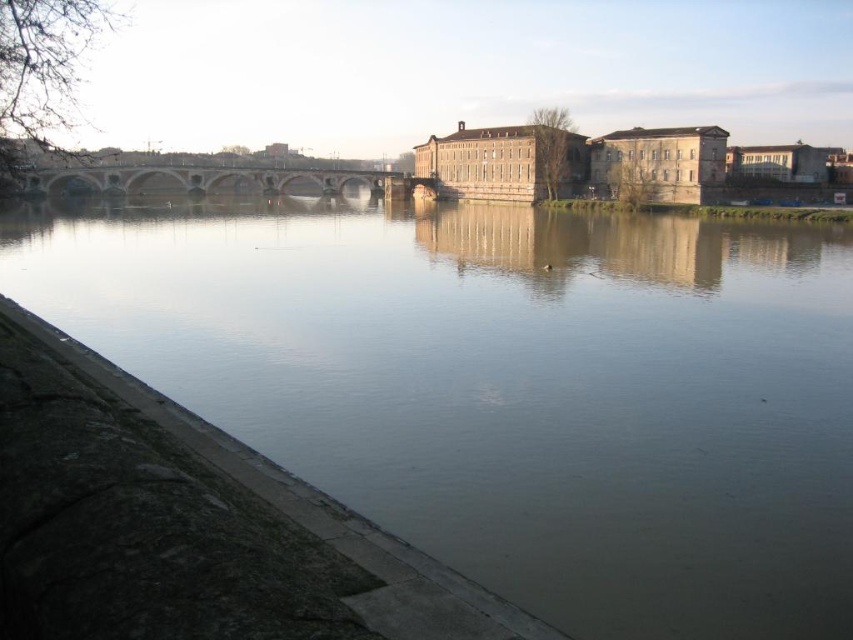
Which of these two, greenish water at lower left or brown stone bridge at center, stands taller?

greenish water at lower left

Who is positioned more to the left, greenish water at lower left or brown stone bridge at center?

brown stone bridge at center is more to the left.

Describe the element at coordinates (506, 385) in the screenshot. I see `greenish water at lower left` at that location.

The height and width of the screenshot is (640, 853). In order to click on greenish water at lower left in this screenshot , I will do `click(506, 385)`.